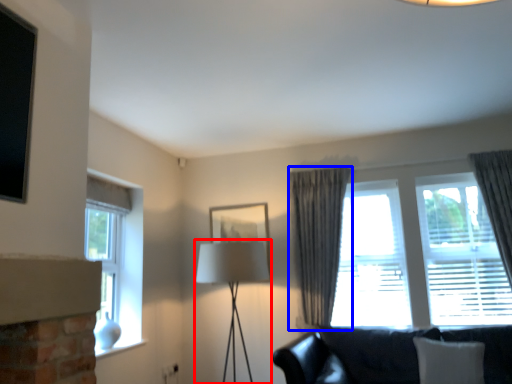
Question: Which point is closer to the camera, table lamp (highlighted by a red box) or curtain (highlighted by a blue box)?

Choices:
 (A) table lamp
 (B) curtain

Answer: (A)